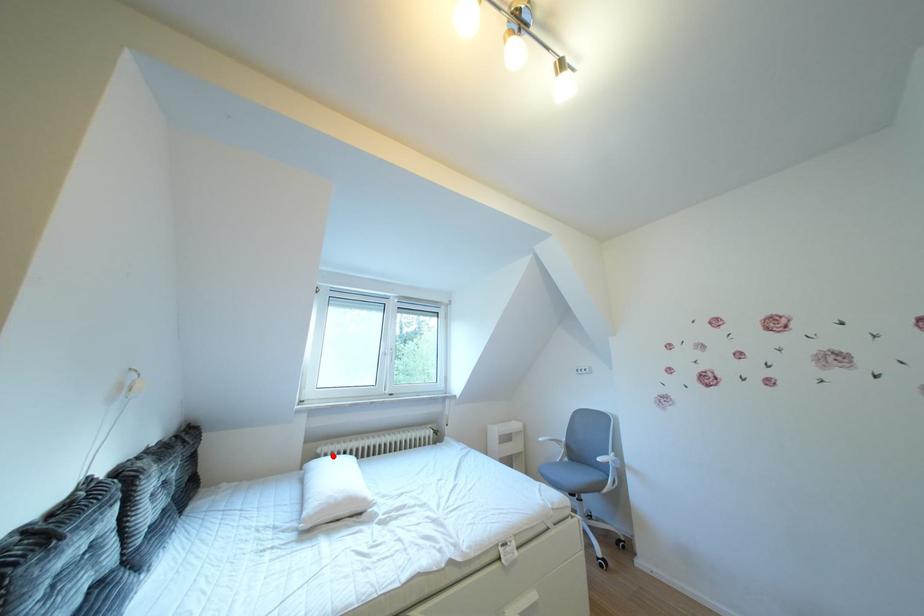
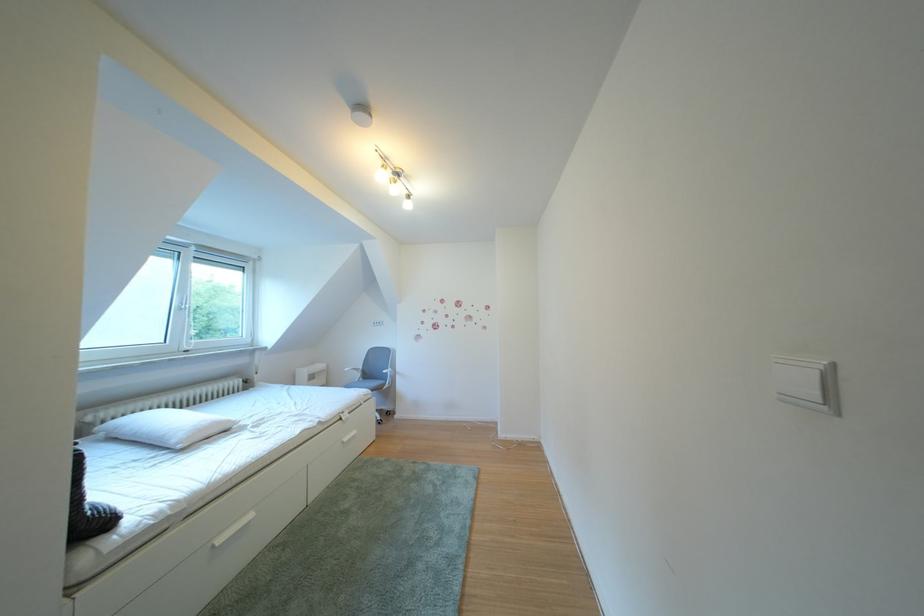
Question: A red point is marked in image1. In image2, is the corresponding 3D point closer to the camera or farther? Reply with the corresponding letter.

Choices:
 (A) The corresponding 3D point is closer.
 (B) The corresponding 3D point is farther.

Answer: (B)